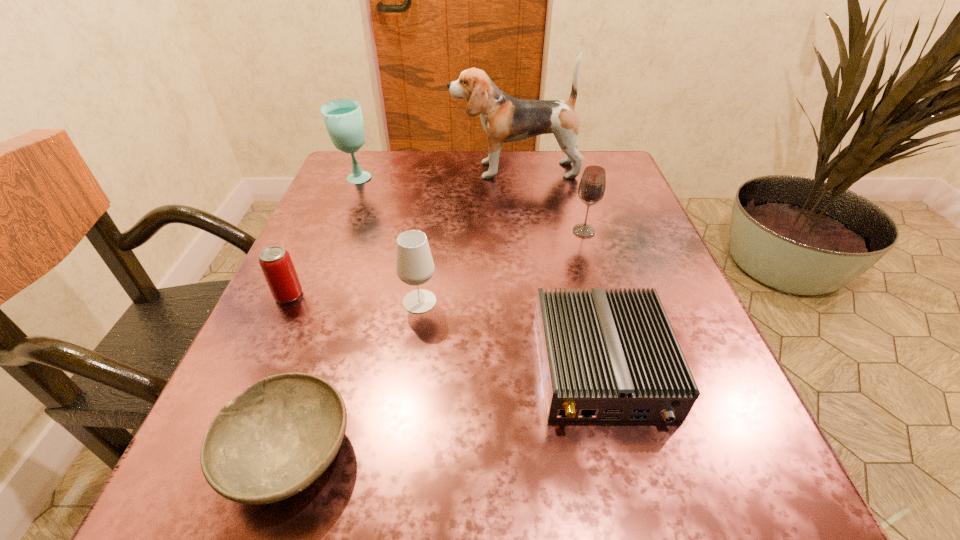
Where is `the tallest object`? This screenshot has height=540, width=960. the tallest object is located at coordinates (504, 118).

Find the location of a particular element. This screenshot has width=960, height=540. the farthest glass is located at coordinates (343, 118).

Locate an element on the screen. The image size is (960, 540). the tallest glass is located at coordinates (343, 118).

Locate an element on the screen. The width and height of the screenshot is (960, 540). the second nearest glass is located at coordinates (591, 189).

This screenshot has width=960, height=540. What are the coordinates of `the third farthest object` in the screenshot? It's located at 591,189.

Where is `the second glass from left to right`? the second glass from left to right is located at coordinates (414, 264).

What are the coordinates of `the fourth object from right to left` in the screenshot? It's located at (414, 264).

Identify the location of the fifth tallest object. pyautogui.click(x=276, y=264).

The height and width of the screenshot is (540, 960). I want to click on router, so click(605, 356).

Find the location of a particular element. This screenshot has width=960, height=540. bowl is located at coordinates (272, 441).